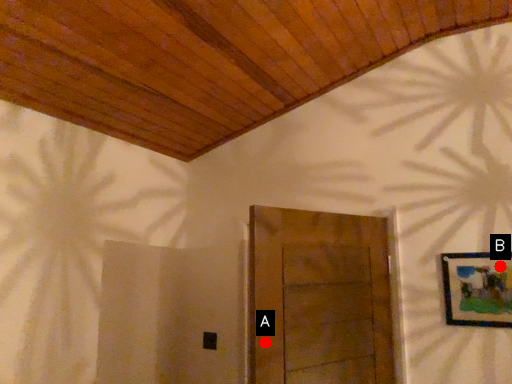
Question: Two points are circled on the image, labeled by A and B beside each circle. Which of the following is the farthest from the observer?

Choices:
 (A) A is further
 (B) B is further

Answer: (B)